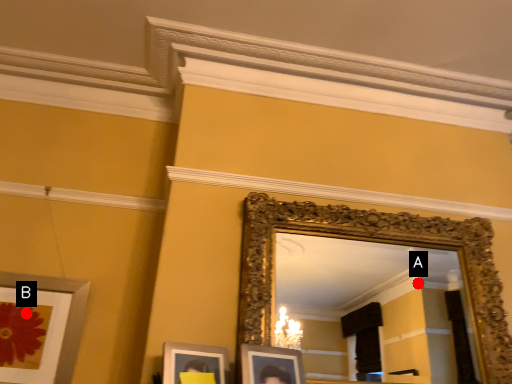
Question: Two points are circled on the image, labeled by A and B beside each circle. Which point is closer to the camera?

Choices:
 (A) A is closer
 (B) B is closer

Answer: (B)